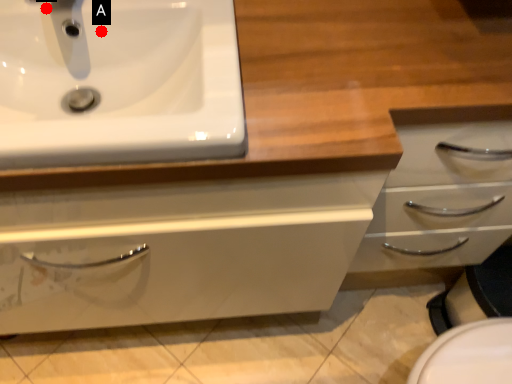
Question: Two points are circled on the image, labeled by A and B beside each circle. Which point is further to the camera?

Choices:
 (A) A is further
 (B) B is further

Answer: (A)